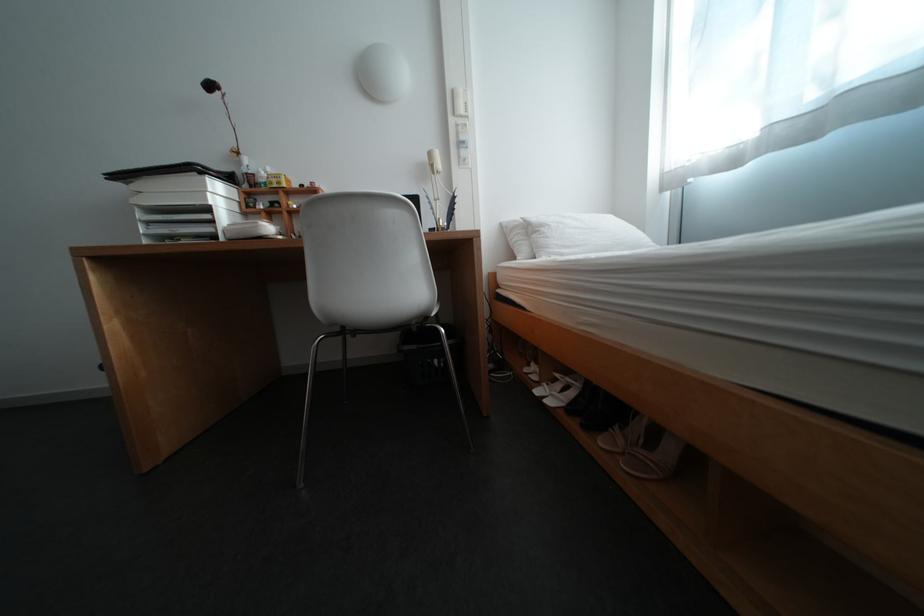
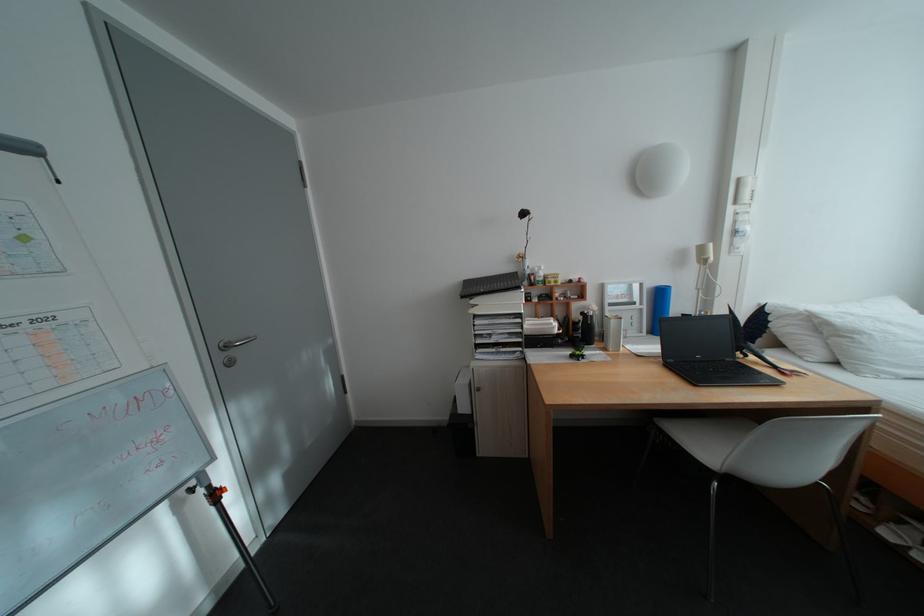
The point at (447, 229) is marked in the first image. Where is the corresponding point in the second image?

(703, 315)